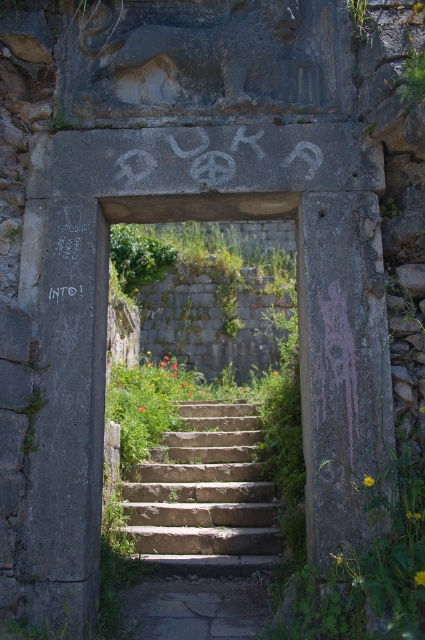
Who is more distant from viewer, [189,509] or [220,532]?

The point [189,509] is more distant.

What do you see at coordinates (204, 442) in the screenshot?
I see `stone steps at center` at bounding box center [204, 442].

Does point (291, 518) come behind point (268, 518)?

No, it is not.

This screenshot has height=640, width=425. What are the coordinates of `stone steps at center` in the screenshot? It's located at (204, 442).